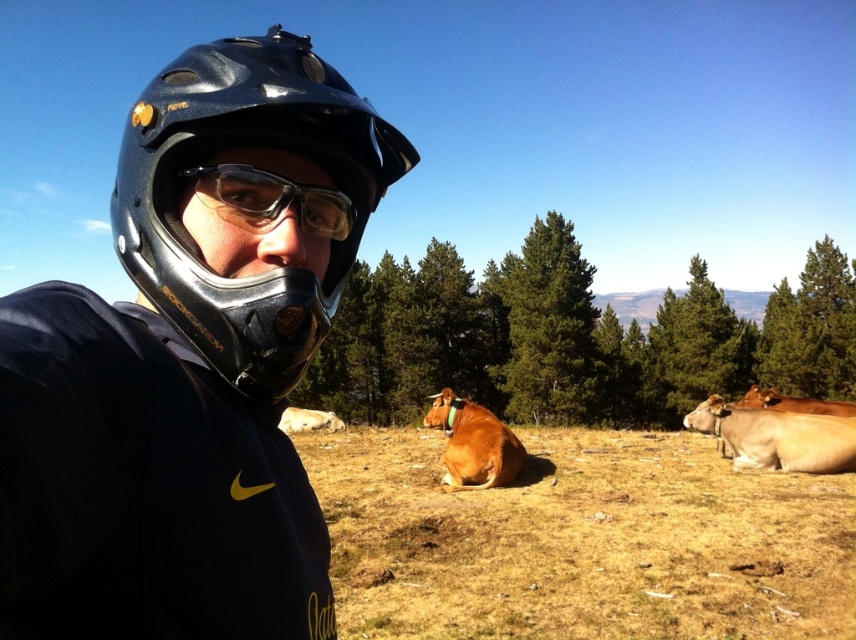
You are a hiker who just found a pair of transparent plastic goggles at center. You need to pick them up to use them for protection from debris while hiking. Can you safely reach them without moving from your current position?

The transparent plastic goggles at center are 28.53 inches away from the viewer, so yes, you can safely reach them without moving from your current position.

You are a photographer trying to capture both the black matte helmet at center and the brown leather cow at right in a single shot. Based on their sizes in the image, which object would appear smaller in the photo?

The black matte helmet at center appears smaller in the photo because it is not as tall as the brown leather cow at right, which is taller.